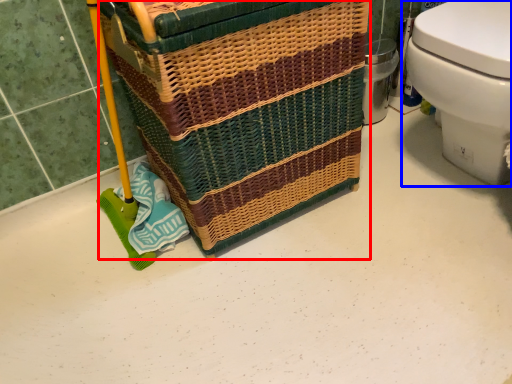
Question: Which point is closer to the camera, basket container (highlighted by a red box) or toilet (highlighted by a blue box)?

Choices:
 (A) basket container
 (B) toilet

Answer: (A)